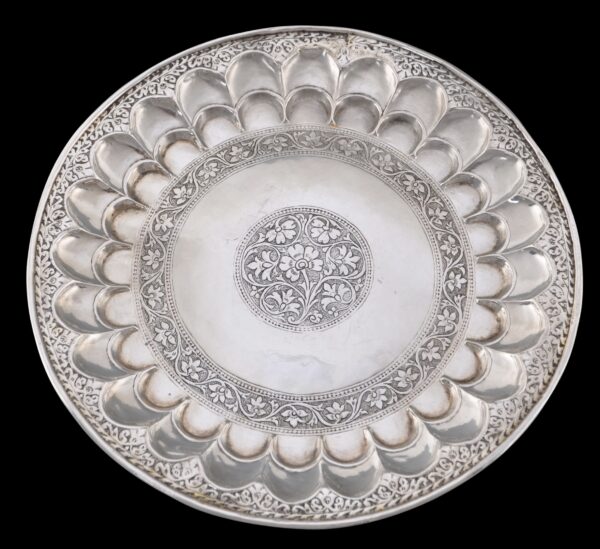
At what (x,y) coordinates should I click in order to perform the action: click on center floral design. Please return your answer as a coordinate pair (x, y). Looking at the image, I should click on (301, 268).